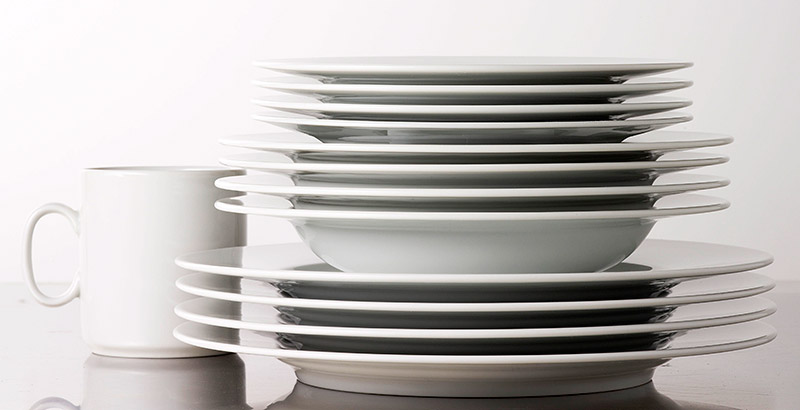
Image resolution: width=800 pixels, height=410 pixels. What are the coordinates of `bowls` in the screenshot? It's located at (462, 227), (484, 191), (492, 172), (508, 149).